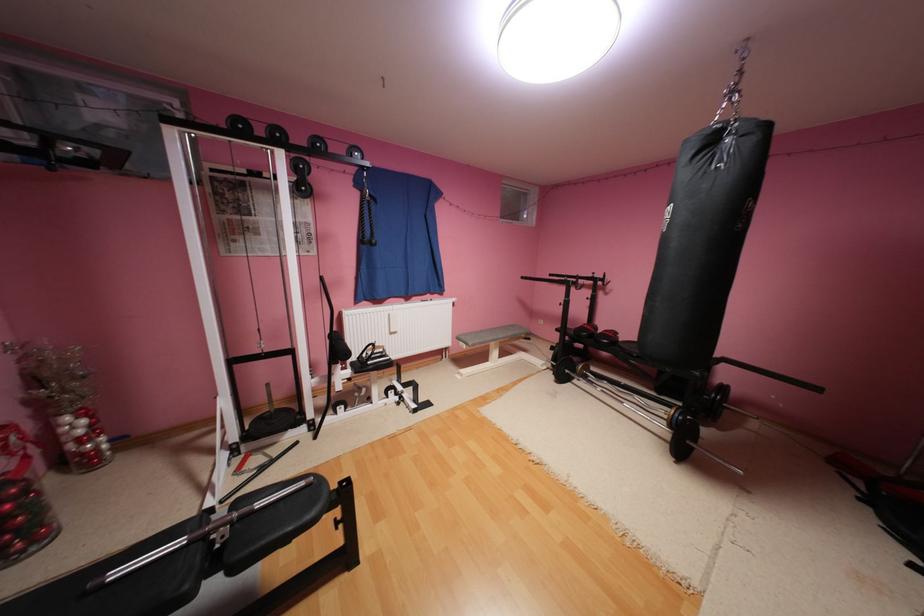
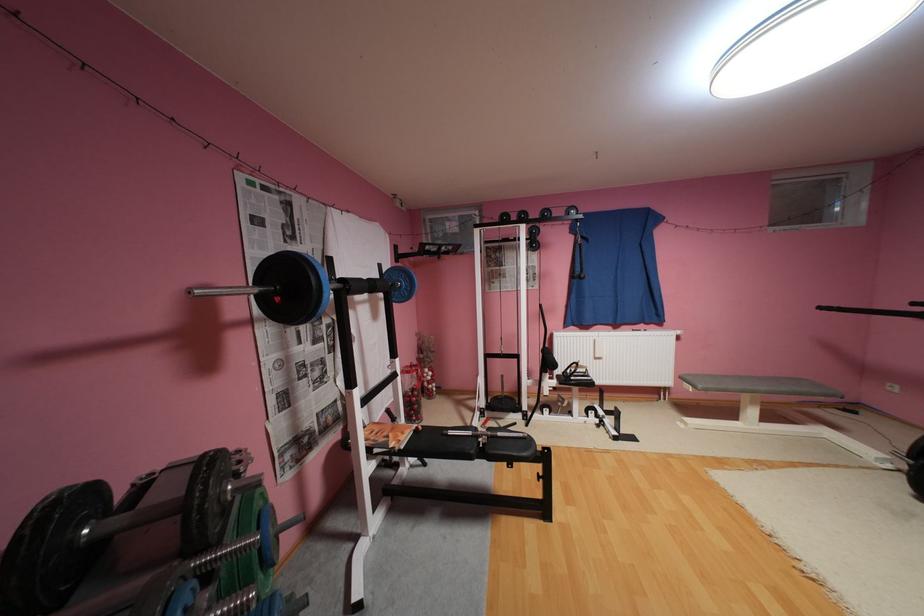
Where in the second image is the point corresponding to (508,336) from the first image?

(771, 387)